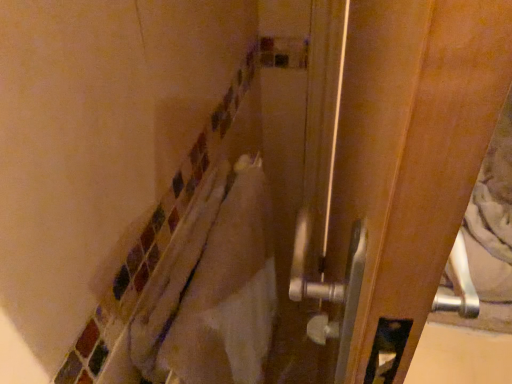
Question: Is point (460, 41) positioned closer to the camera than point (197, 329)?

Choices:
 (A) farther
 (B) closer

Answer: (B)

Question: Relative to white towel at center, is wooden screen door at right in front or behind?

Choices:
 (A) front
 (B) behind

Answer: (A)

Question: From a real-world perspective, is wooden screen door at right positioned above or below white towel at center?

Choices:
 (A) below
 (B) above

Answer: (B)

Question: Does point (268, 259) appear closer or farther from the camera than point (456, 135)?

Choices:
 (A) farther
 (B) closer

Answer: (A)

Question: Is white towel at center taller or shorter than wooden screen door at right?

Choices:
 (A) short
 (B) tall

Answer: (A)

Question: Is white towel at center wider or thinner than wooden screen door at right?

Choices:
 (A) thin
 (B) wide

Answer: (B)

Question: In the image, is white towel at center on the left side or the right side of wooden screen door at right?

Choices:
 (A) right
 (B) left

Answer: (B)